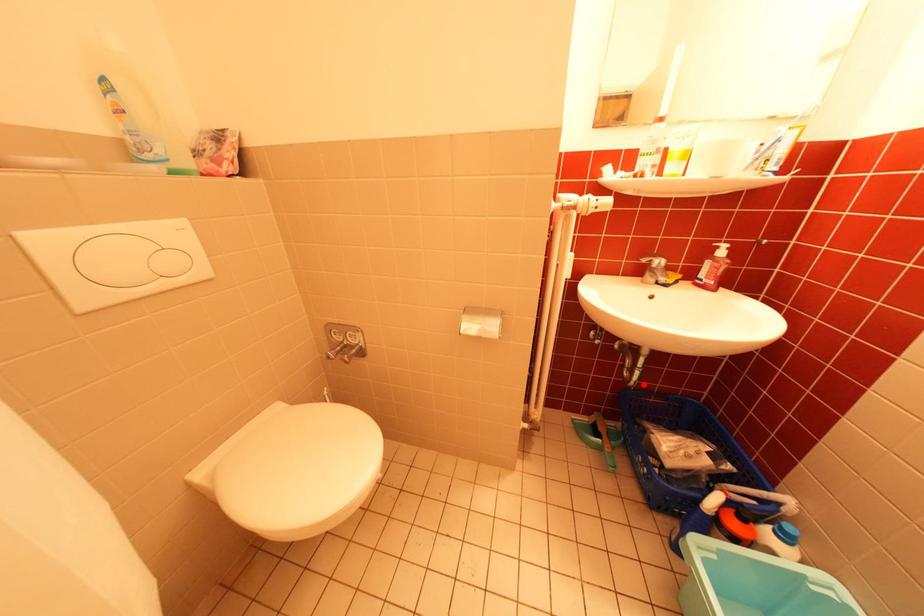
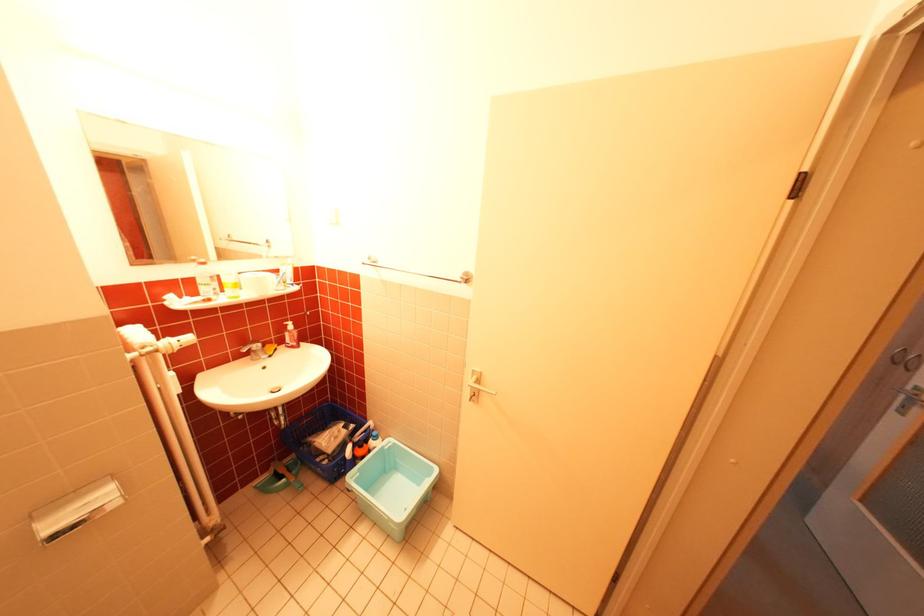
Question: I am providing you with two images of the same scene from different viewpoints. Given a red point in image1, look at the same physical point in image2. Is it:

Choices:
 (A) Closer to the viewpoint
 (B) Farther from the viewpoint

Answer: (A)